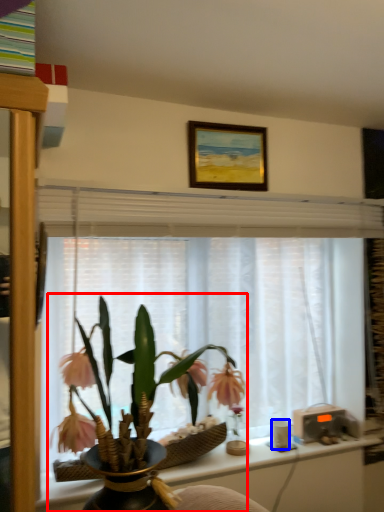
Question: Which object is further to the camera taking this photo, houseplant (highlighted by a red box) or coffee cup (highlighted by a blue box)?

Choices:
 (A) houseplant
 (B) coffee cup

Answer: (B)